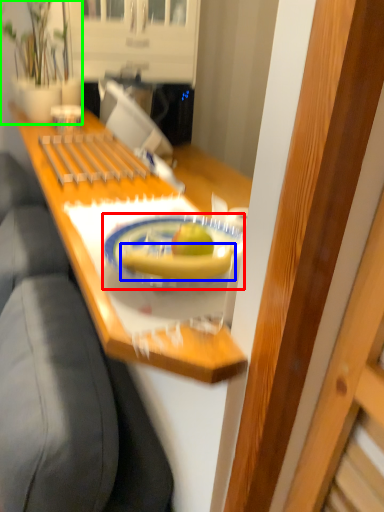
Question: Which object is positioned farthest from plate (highlighted by a red box)? Select from banana (highlighted by a blue box) and houseplant (highlighted by a green box).

Choices:
 (A) banana
 (B) houseplant

Answer: (B)